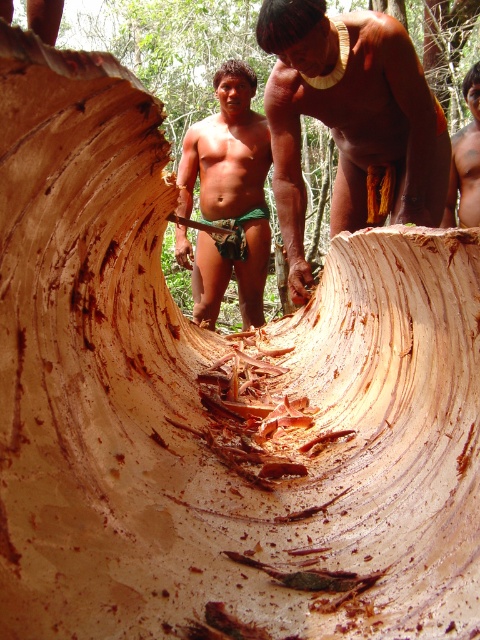
Question: Does smooth brown wood at center appear on the right side of brown textured skin at upper center?

Choices:
 (A) no
 (B) yes

Answer: (A)

Question: Which object appears farthest from the camera in this image?

Choices:
 (A) matte green shorts at center
 (B) brown textured skin at upper center
 (C) smooth brown wood at center

Answer: (A)

Question: Is matte green shorts at center thinner than brown textured skin at upper center?

Choices:
 (A) yes
 (B) no

Answer: (B)

Question: Which is farther from the smooth brown wood at center?

Choices:
 (A) brown textured skin at upper center
 (B) matte green shorts at center

Answer: (B)

Question: Is smooth brown wood at center behind matte green shorts at center?

Choices:
 (A) no
 (B) yes

Answer: (A)

Question: Which point is farther from the camera taking this photo?

Choices:
 (A) (448, 177)
 (B) (300, 99)

Answer: (A)